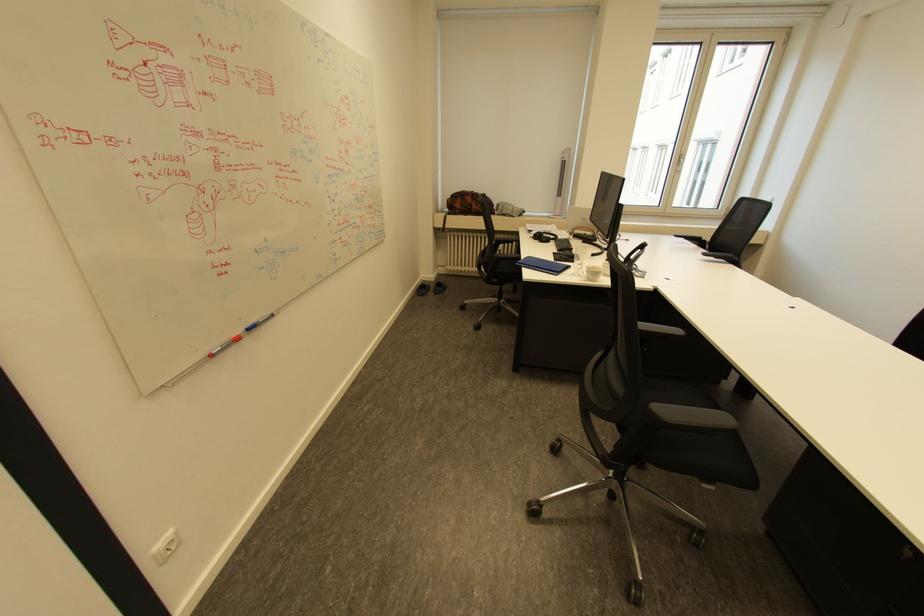
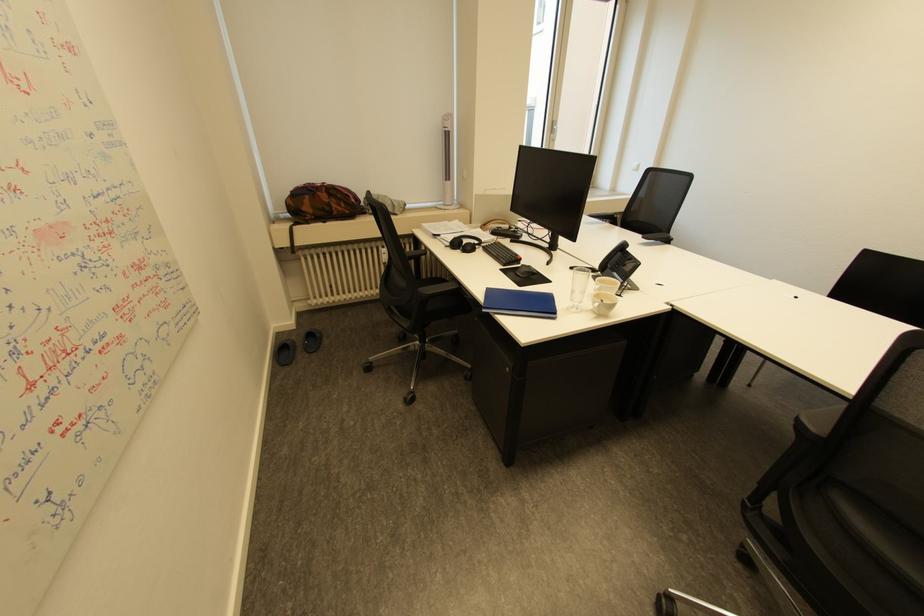
Find the pixel in the second image that matches the point at 500,205 in the first image.

(367, 200)